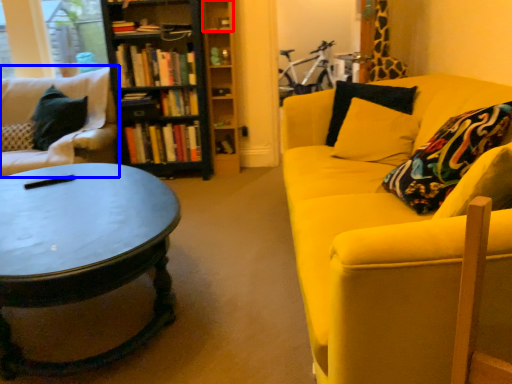
Question: Which object appears closest to the camera in this image, shelf (highlighted by a red box) or studio couch (highlighted by a blue box)?

Choices:
 (A) shelf
 (B) studio couch

Answer: (B)